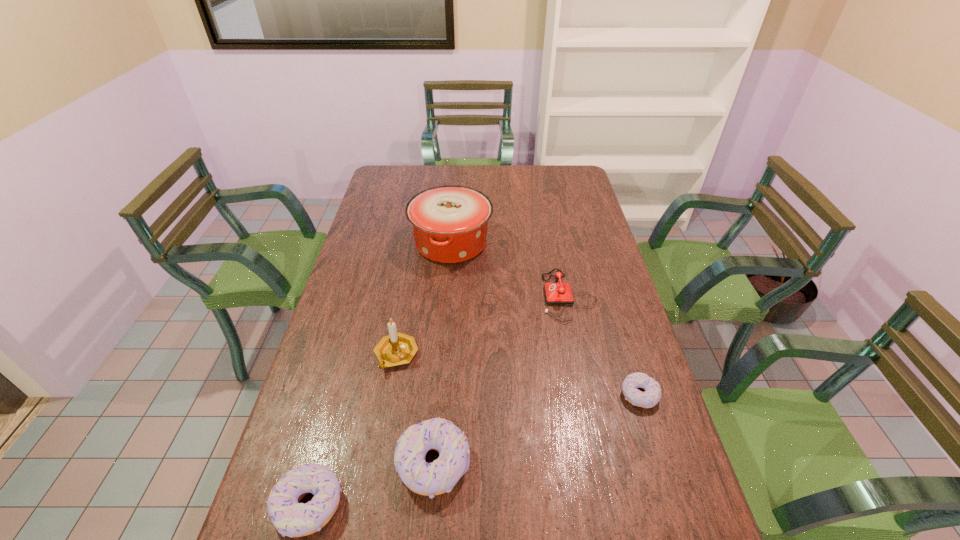
Identify the location of the second doughnut from right to left. The height and width of the screenshot is (540, 960). (429, 479).

The width and height of the screenshot is (960, 540). Find the location of `the shortest doughnut`. the shortest doughnut is located at coordinates (648, 399).

I want to click on the shortest object, so click(x=648, y=399).

The height and width of the screenshot is (540, 960). I want to click on casserole, so click(449, 223).

I want to click on telephone, so (558, 293).

Where is `candle holder`? The image size is (960, 540). candle holder is located at coordinates (395, 349).

Image resolution: width=960 pixels, height=540 pixels. In order to click on the second tallest object in this screenshot , I will do `click(395, 349)`.

Locate an element on the screen. The width and height of the screenshot is (960, 540). free spot located 0.210m on the right of the second doughnut from right to left is located at coordinates (561, 464).

Where is `free space located 0.100m on the back of the rightmost doughnut`? The width and height of the screenshot is (960, 540). free space located 0.100m on the back of the rightmost doughnut is located at coordinates 626,350.

At what (x,y) coordinates should I click in order to perform the action: click on vacant space located on the front of the tallest object. Please return your answer as a coordinate pair (x, y). The width and height of the screenshot is (960, 540). Looking at the image, I should click on (444, 330).